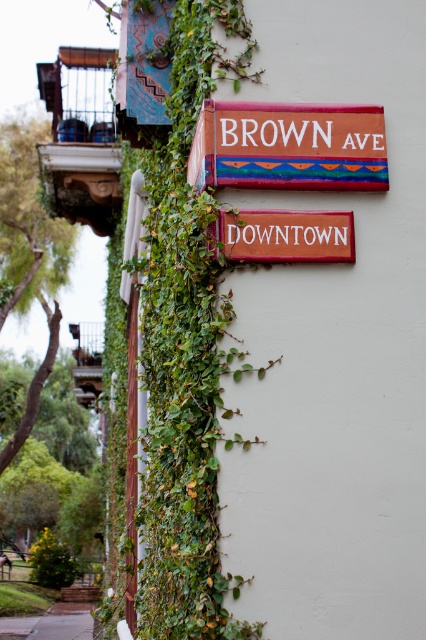
You are standing in front of a building with two wooden signs. The painted wood sign at upper center and the red wood downtown sign at center are both on the wall. Which sign is positioned higher up?

The painted wood sign at upper center is positioned higher up than the red wood downtown sign at center because it is located above it.

You are standing in front of the building exterior described. There is a painted wood sign at upper center. Can you determine its exact location based on the coordinates provided?

The painted wood sign at upper center is located at point coordinates of (288,147).

You are standing in front of the building wall with two signs. You notice two points marked on the wall at coordinates point (325, 136) and point (256, 241). Which point is closer to you?

Point (325, 136) is further to the viewer than point (256, 241), so the point closer to you is point (256, 241).